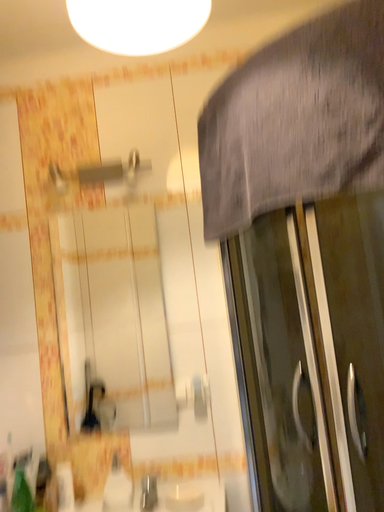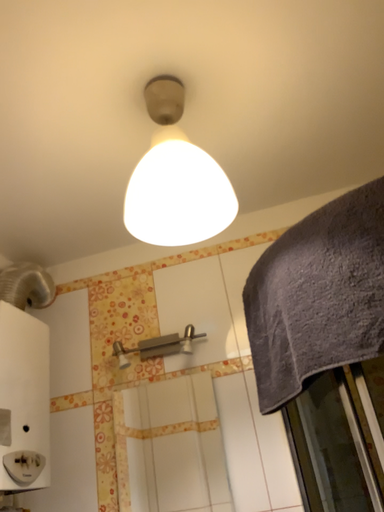
Question: Which way did the camera rotate in the video?

Choices:
 (A) rotated right
 (B) rotated left

Answer: (B)